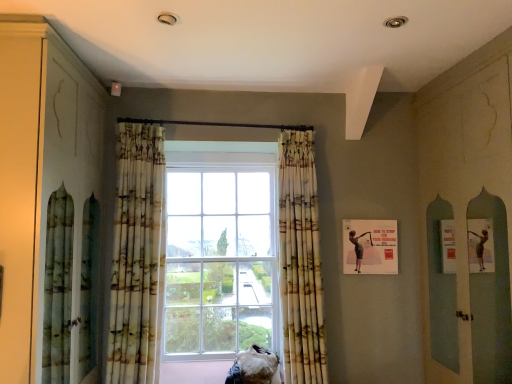
Question: Is printed fabric curtain at center, which is the 1th curtain from right to left, spatially inside matte paper poster at right, or outside of it?

Choices:
 (A) inside
 (B) outside

Answer: (B)

Question: Would you say printed fabric curtain at center, the second curtain in the left-to-right sequence, is to the left or to the right of matte paper poster at right in the picture?

Choices:
 (A) left
 (B) right

Answer: (A)

Question: Which object is the farthest from the printed fabric curtain at center, which ranks as the 2th curtain in right-to-left order?

Choices:
 (A) matte paper poster at right
 (B) matte green cabinet at left
 (C) printed fabric curtain at center, the second curtain in the left-to-right sequence

Answer: (A)

Question: Based on their relative distances, which object is nearer to the printed fabric curtain at center, which is the 1th curtain from right to left?

Choices:
 (A) matte green cabinet at left
 (B) printed fabric curtain at center, which ranks as the 2th curtain in right-to-left order
 (C) matte paper poster at right

Answer: (C)